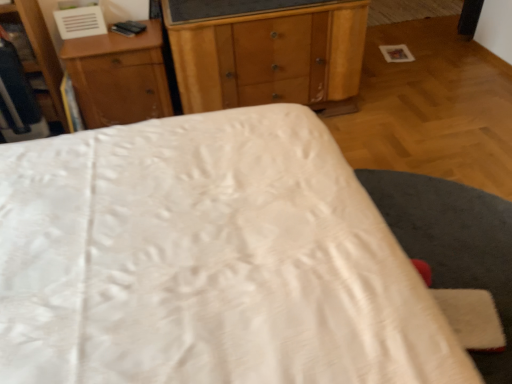
Where is `vacant area on top of wooden nightstand at upper center (from a real-world perspective)`? Image resolution: width=512 pixels, height=384 pixels. vacant area on top of wooden nightstand at upper center (from a real-world perspective) is located at coordinates (108, 38).